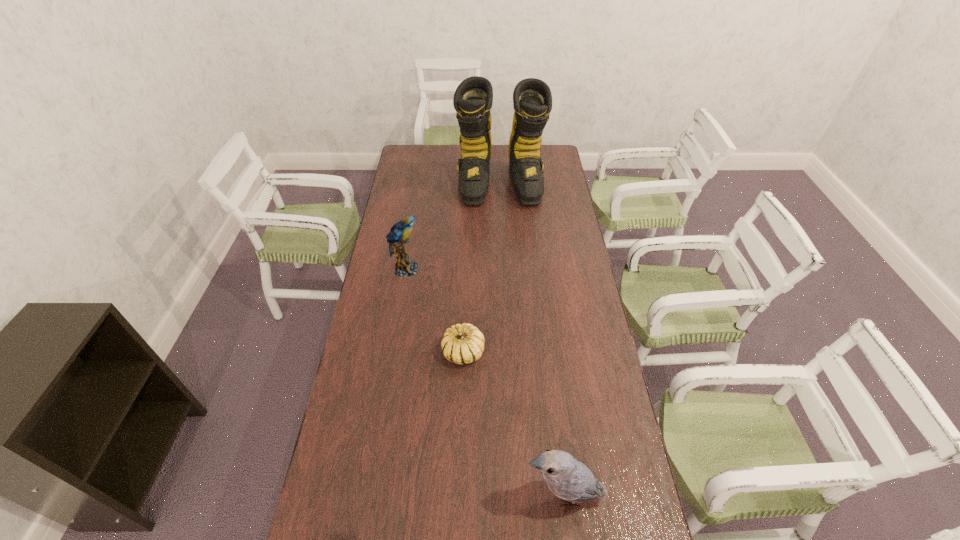
Where is `free space located on the front-facing side of the nearest object`? The width and height of the screenshot is (960, 540). free space located on the front-facing side of the nearest object is located at coordinates (417, 496).

Find the location of a particular element. Image resolution: width=960 pixels, height=540 pixels. vacant space located 0.200m on the front-facing side of the nearest object is located at coordinates (450, 496).

Where is `free space located on the front-facing side of the nearest object`? This screenshot has width=960, height=540. free space located on the front-facing side of the nearest object is located at coordinates (497, 496).

Image resolution: width=960 pixels, height=540 pixels. I want to click on vacant space located 0.070m on the back of the second nearest object, so pos(465,321).

Where is `object located in the far edge section of the desktop`? object located in the far edge section of the desktop is located at coordinates (532, 100).

Find the location of a particular element. object present at the left edge is located at coordinates (398, 236).

This screenshot has width=960, height=540. I want to click on ski boots located in the right edge section of the desktop, so click(532, 100).

Find the location of a particular element. parrot that is at the right edge is located at coordinates (567, 478).

Identify the location of object that is at the far right corner. (532, 100).

I want to click on vacant space at the left edge of the desktop, so click(x=394, y=402).